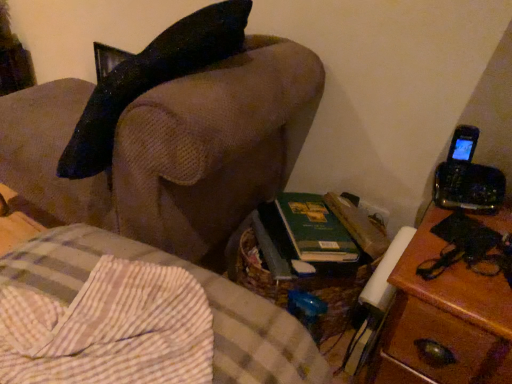
Question: Can you confirm if wooden nightstand at right is positioned to the right of brown woven basket at lower center, placed as the 1th furniture when sorted from bottom to top?

Choices:
 (A) yes
 (B) no

Answer: (A)

Question: Is wooden nightstand at right located outside brown woven basket at lower center, the second furniture from the top?

Choices:
 (A) no
 (B) yes

Answer: (B)

Question: Is wooden nightstand at right facing away from brown woven basket at lower center, placed as the 1th furniture when sorted from bottom to top?

Choices:
 (A) no
 (B) yes

Answer: (A)

Question: Would you say wooden nightstand at right is a long distance from brown woven basket at lower center, placed as the 1th furniture when sorted from bottom to top?

Choices:
 (A) yes
 (B) no

Answer: (B)

Question: Is wooden nightstand at right oriented towards brown woven basket at lower center, the second furniture from the top?

Choices:
 (A) no
 (B) yes

Answer: (A)

Question: Considering the positions of wooden nightstand at right and brown fabric couch at upper left, the 1th furniture positioned from the top, in the image, is wooden nightstand at right wider or thinner than brown fabric couch at upper left, the 1th furniture positioned from the top,?

Choices:
 (A) thin
 (B) wide

Answer: (A)

Question: From a real-world perspective, is wooden nightstand at right positioned above or below brown fabric couch at upper left, the second furniture in the bottom-to-top sequence?

Choices:
 (A) below
 (B) above

Answer: (A)

Question: Is wooden nightstand at right taller or shorter than brown fabric couch at upper left, the second furniture in the bottom-to-top sequence?

Choices:
 (A) tall
 (B) short

Answer: (B)

Question: Based on their sizes in the image, would you say wooden nightstand at right is bigger or smaller than brown fabric couch at upper left, the second furniture in the bottom-to-top sequence?

Choices:
 (A) big
 (B) small

Answer: (B)

Question: In the image, is brown fabric couch at upper left, the second furniture in the bottom-to-top sequence, on the left side or the right side of wooden nightstand at right?

Choices:
 (A) right
 (B) left

Answer: (B)

Question: From the image's perspective, is brown fabric couch at upper left, the second furniture in the bottom-to-top sequence, located above or below wooden nightstand at right?

Choices:
 (A) below
 (B) above

Answer: (B)

Question: Is brown fabric couch at upper left, the 1th furniture positioned from the top, taller or shorter than wooden nightstand at right?

Choices:
 (A) tall
 (B) short

Answer: (A)

Question: From a real-world perspective, is brown fabric couch at upper left, the second furniture in the bottom-to-top sequence, positioned above or below wooden nightstand at right?

Choices:
 (A) below
 (B) above

Answer: (B)

Question: Is brown woven basket at lower center, the second furniture from the top, wider or thinner than brown fabric couch at upper left, the 1th furniture positioned from the top?

Choices:
 (A) thin
 (B) wide

Answer: (B)

Question: Relative to brown fabric couch at upper left, the second furniture in the bottom-to-top sequence, is brown woven basket at lower center, placed as the 1th furniture when sorted from bottom to top, in front or behind?

Choices:
 (A) front
 (B) behind

Answer: (A)